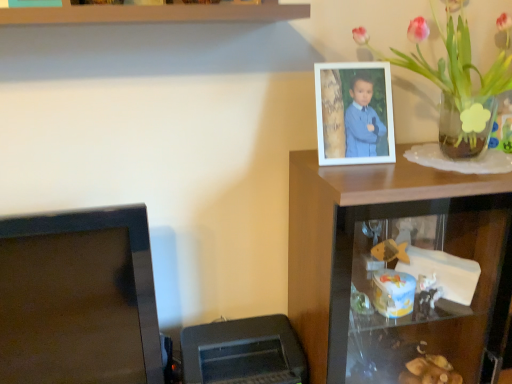
You are a GUI agent. You are given a task and a screenshot of the screen. Output one action in this format:
    pyautogui.click(x=<x>, y=<y>)
    Task: Click on the free space in front of white matte picture frame at upper right
    This screenshot has height=384, width=512.
    Given the screenshot: What is the action you would take?
    pyautogui.click(x=367, y=174)